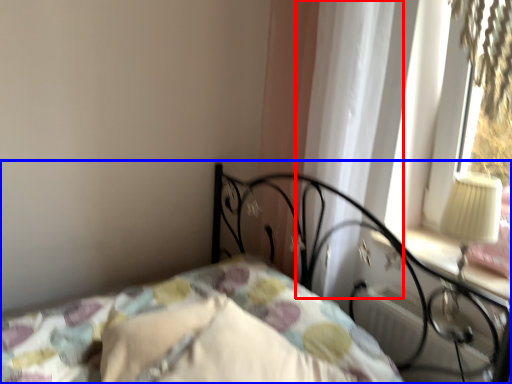
Question: Which of the following is the closest to the observer, curtain (highlighted by a red box) or bed (highlighted by a blue box)?

Choices:
 (A) curtain
 (B) bed

Answer: (B)